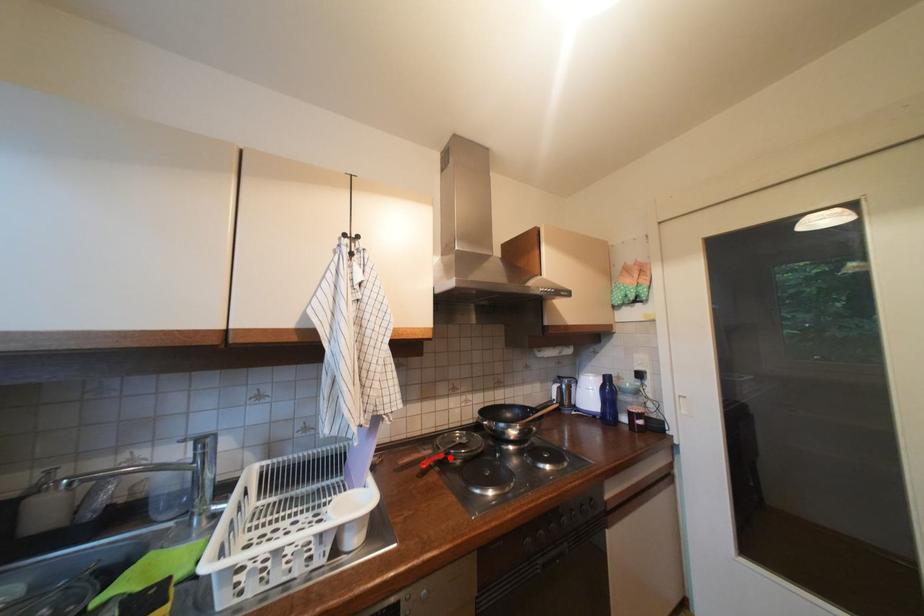
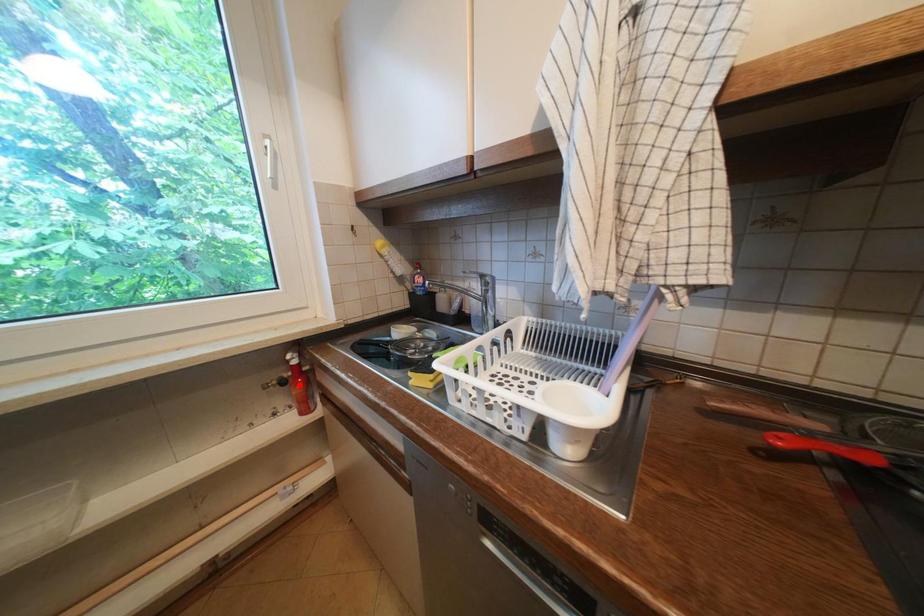
I am providing you with two images of the same scene from different viewpoints. A red point is marked on the first image and another point is marked on the second image. Is the marked point in image1 the same physical position as the marked point in image2?

No